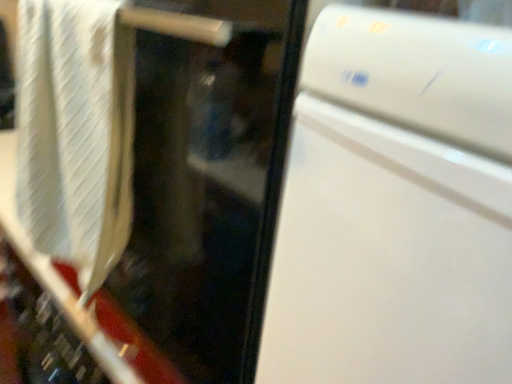
Identify the location of white textured bath towel at left. Image resolution: width=512 pixels, height=384 pixels. (75, 133).

What do you see at coordinates (75, 133) in the screenshot? The height and width of the screenshot is (384, 512). I see `white textured bath towel at left` at bounding box center [75, 133].

Find the location of a particular element. white textured bath towel at left is located at coordinates (75, 133).